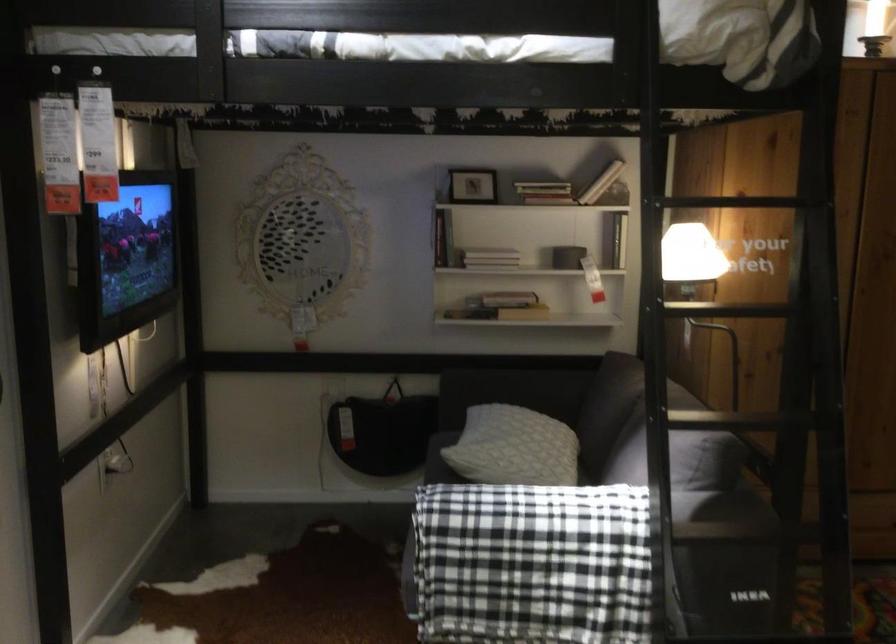
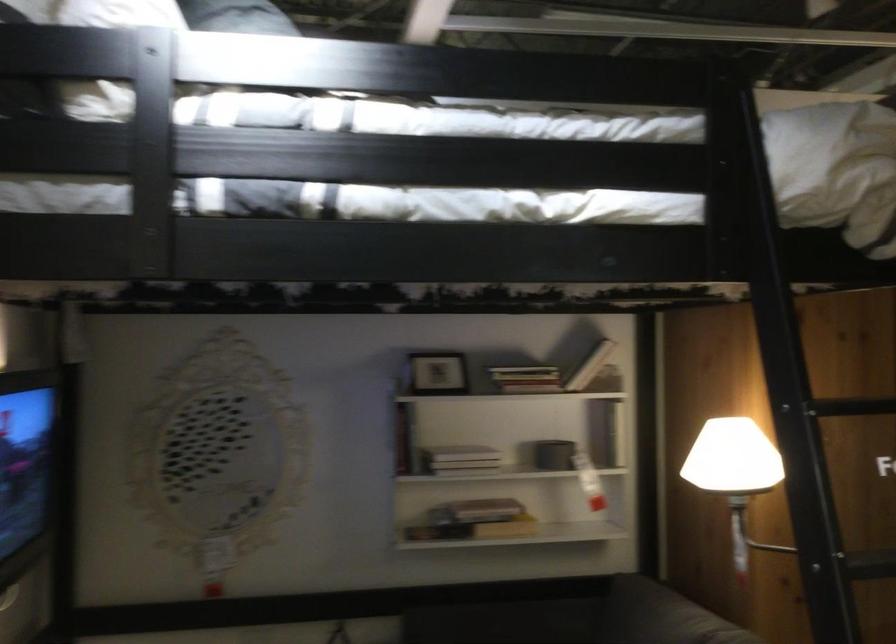
Question: How did the camera likely rotate?

Choices:
 (A) Left
 (B) Right
 (C) Up
 (D) Down

Answer: (C)